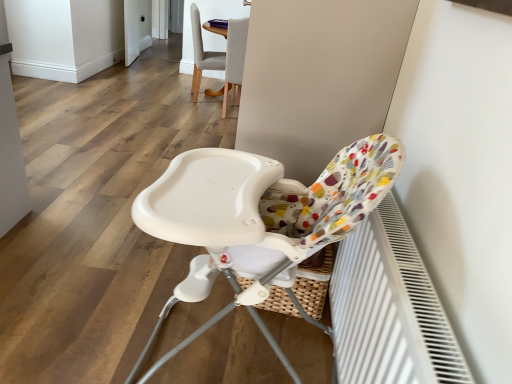
This screenshot has width=512, height=384. I want to click on vacant location below white plastic highchair at center, which is the third chair in top-to-bottom order (from a real-world perspective), so click(226, 360).